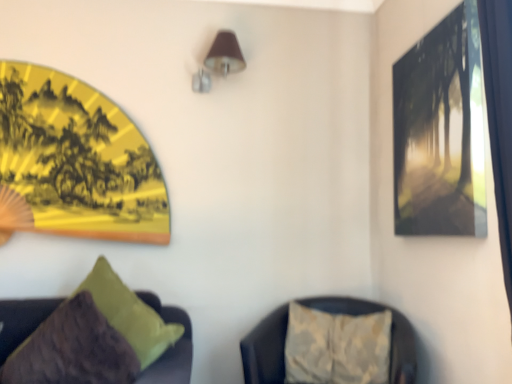
Question: Would you say velvet green pillow at lower left, the second furniture when ordered from right to left, is to the left or to the right of yellow paper fan at upper left, placed as the 2th picture frame when sorted from right to left, in the picture?

Choices:
 (A) left
 (B) right

Answer: (B)

Question: From the image's perspective, is velvet green pillow at lower left, which is the 1th furniture in left-to-right order, located above or below yellow paper fan at upper left, acting as the 1th picture frame starting from the left?

Choices:
 (A) above
 (B) below

Answer: (B)

Question: Which object is the farthest from the textured beige cushion at lower right, marked as the 2th furniture in a left-to-right arrangement?

Choices:
 (A) yellow paper fan at upper left, placed as the 2th picture frame when sorted from right to left
 (B) matte black picture frame at upper right, which is counted as the second picture frame, starting from the back
 (C) brown fabric lampshade at upper center
 (D) velvet green pillow at lower left, which is the 1th furniture in left-to-right order

Answer: (C)

Question: Which object is positioned closest to the yellow paper fan at upper left, which appears as the first picture frame when viewed from the back?

Choices:
 (A) velvet green pillow at lower left, the second furniture when ordered from right to left
 (B) matte black picture frame at upper right, positioned as the 1th picture frame in front-to-back order
 (C) textured beige cushion at lower right, the 1th furniture positioned from the right
 (D) brown fabric lampshade at upper center

Answer: (A)